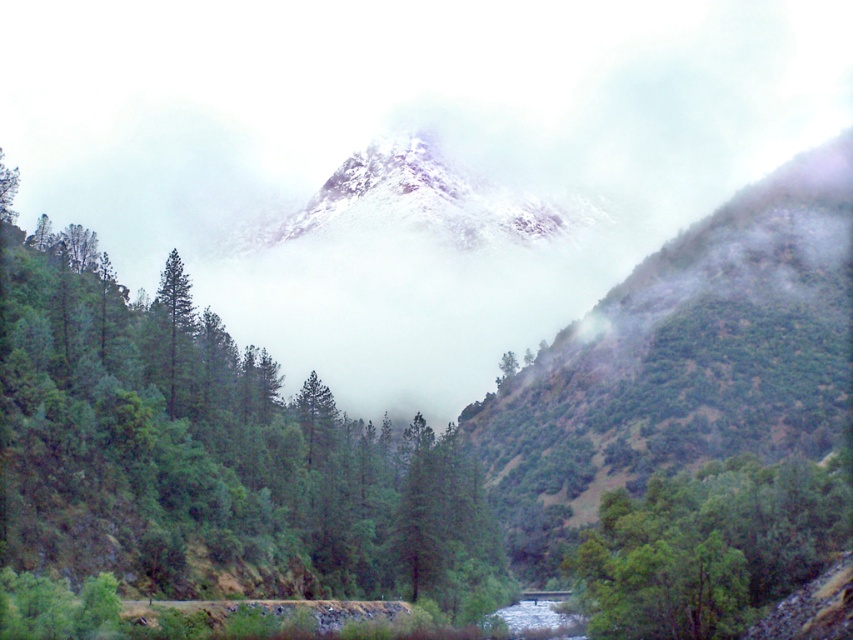
Is green leafy tree at lower right thinner than green matte tree at left?

Incorrect, green leafy tree at lower right's width is not less than green matte tree at left's.

Is point (718, 522) farther from viewer compared to point (171, 259)?

No, it is in front of (171, 259).

Where is `green leafy tree at lower right`? green leafy tree at lower right is located at coordinates (706, 547).

Find the location of `green matte tree at center`. green matte tree at center is located at coordinates (207, 452).

Can you confirm if green matte tree at center is positioned below green leafy tree at lower right?

No, green matte tree at center is not below green leafy tree at lower right.

Describe the element at coordinates (207, 452) in the screenshot. I see `green matte tree at center` at that location.

The height and width of the screenshot is (640, 853). Find the location of `green matte tree at center`. green matte tree at center is located at coordinates (207, 452).

Looking at this image, which is above, green matte tree at center or green matte tree at left?

green matte tree at left

This screenshot has height=640, width=853. What do you see at coordinates (207, 452) in the screenshot? I see `green matte tree at center` at bounding box center [207, 452].

The image size is (853, 640). What are the coordinates of `green matte tree at center` in the screenshot? It's located at (207, 452).